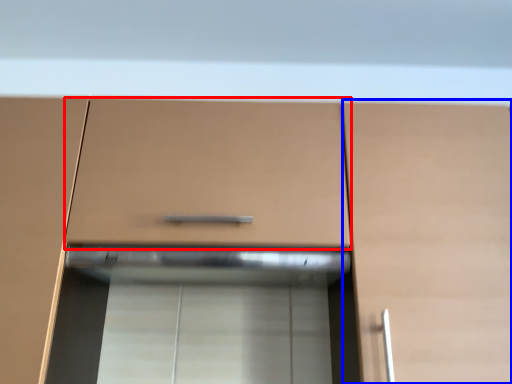
Question: Which point is further to the camera, drawer (highlighted by a red box) or cabinetry (highlighted by a blue box)?

Choices:
 (A) drawer
 (B) cabinetry

Answer: (A)